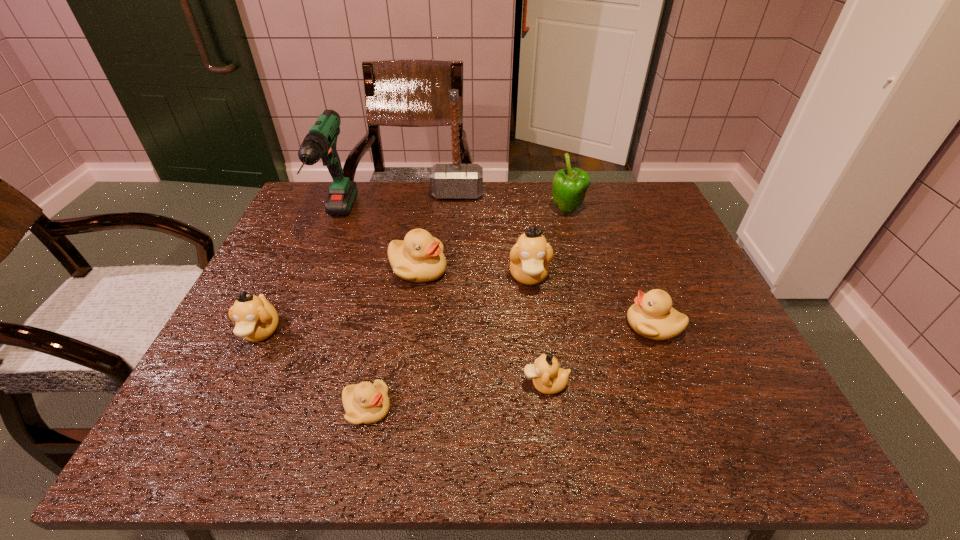
What are the coordinates of `the second smallest yellow duckling` in the screenshot? It's located at (652, 316).

The height and width of the screenshot is (540, 960). Identify the location of the rightmost object. (652, 316).

At what (x,y) coordinates should I click in order to perform the action: click on the nearest tan duckling. Please return your answer as a coordinate pair (x, y). The image size is (960, 540). Looking at the image, I should click on (548, 378).

What are the coordinates of `the shortest object` in the screenshot? It's located at (365, 403).

Find the location of a particular element. The image size is (960, 540). the shortest duckling is located at coordinates (365, 403).

This screenshot has width=960, height=540. Find the location of `vacant space located 0.330m on the striking surface of the hammer`. vacant space located 0.330m on the striking surface of the hammer is located at coordinates (452, 273).

Identify the location of free space located 0.180m on the handle side of the eighth shortest object. (301, 305).

Where is `vacant area situated on the front of the bell pepper`? This screenshot has width=960, height=540. vacant area situated on the front of the bell pepper is located at coordinates (596, 320).

Image resolution: width=960 pixels, height=540 pixels. I want to click on vacant area situated 0.250m on the face of the biggest tan duckling, so click(x=542, y=386).

Find the location of a particular element. This screenshot has height=540, width=960. vacant space located 0.250m on the beak of the farthest yellow duckling is located at coordinates (545, 269).